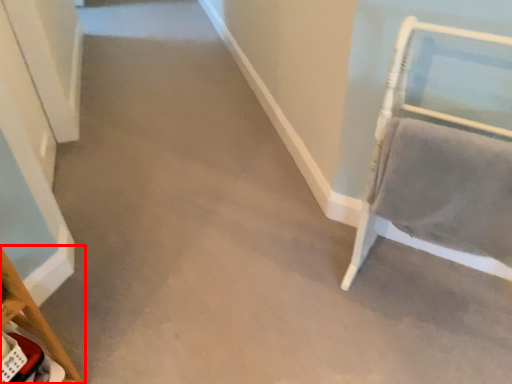
Question: From the image's perspective, what is the correct spatial positioning of furniture (annotated by the red box) in reference to furniture?

Choices:
 (A) below
 (B) above

Answer: (A)